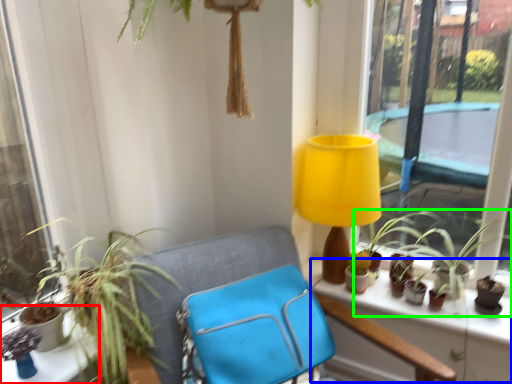
Question: Considering the real-world distances, which object is closest to table (highlighted by a red box)? window sill (highlighted by a blue box) or houseplant (highlighted by a green box).

Choices:
 (A) window sill
 (B) houseplant

Answer: (A)